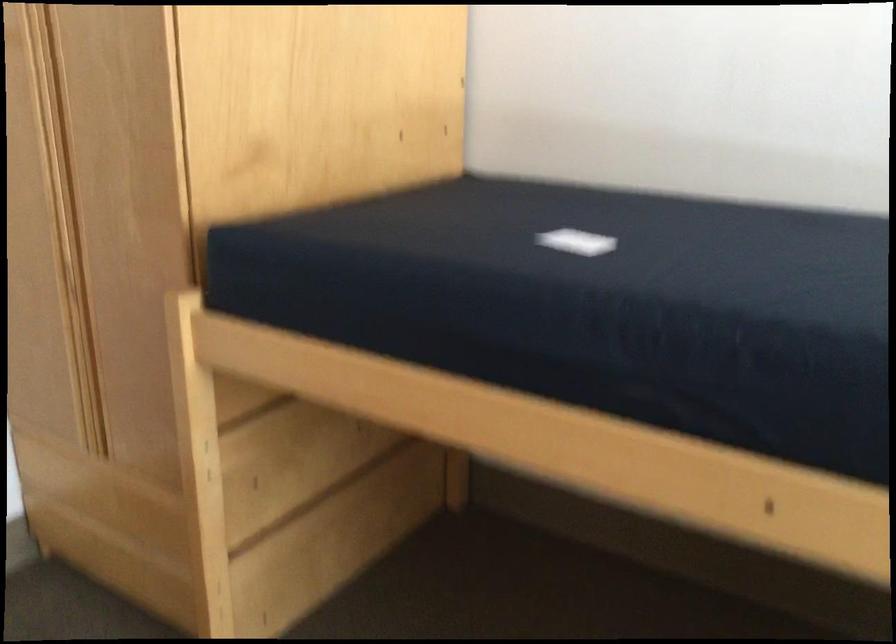
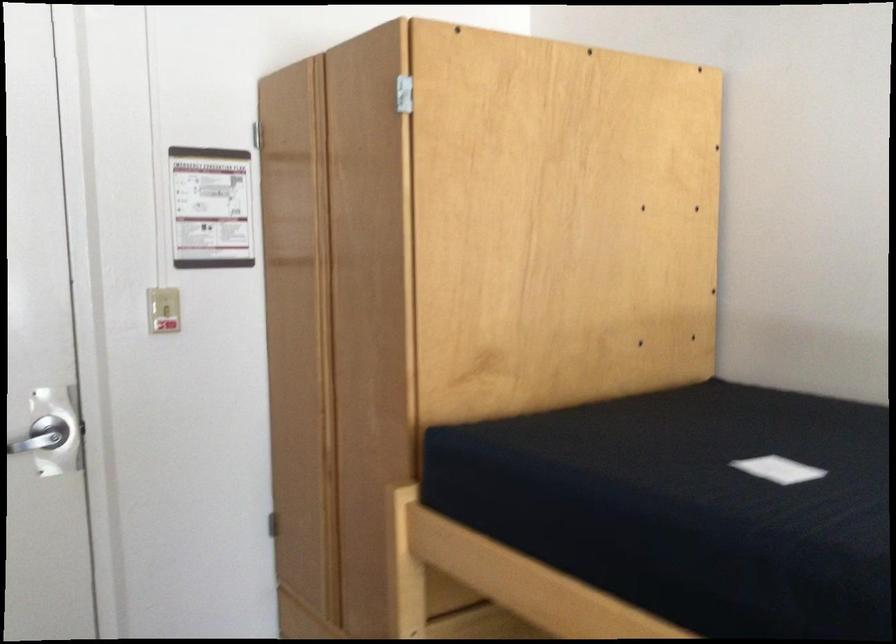
Question: Based on the continuous images, in which direction is the camera rotating? Reply with the corresponding letter.

Choices:
 (A) Left
 (B) Right
 (C) Up
 (D) Down

Answer: (A)